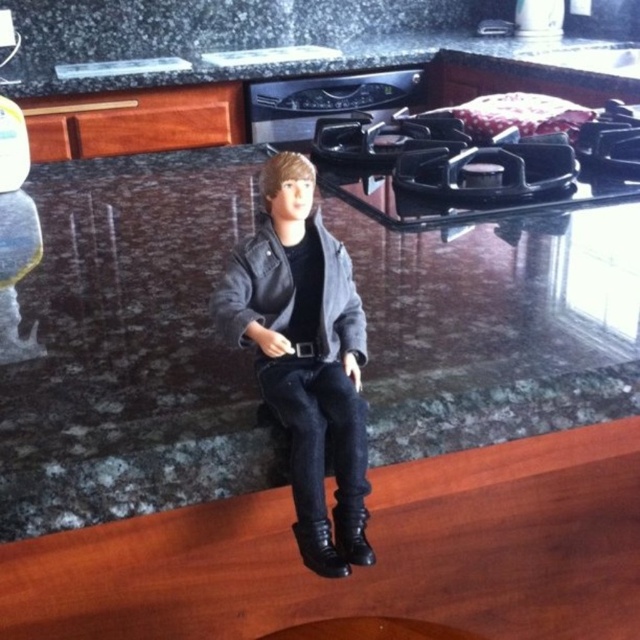
Question: Which object is closer to the camera taking this photo?

Choices:
 (A) leather jacket at center
 (B) granite countertop at upper center

Answer: (A)

Question: Observing the image, what is the correct spatial positioning of granite countertop at upper center in reference to leather jacket at center?

Choices:
 (A) above
 (B) below

Answer: (A)

Question: Is the position of granite countertop at upper center more distant than that of leather jacket at center?

Choices:
 (A) no
 (B) yes

Answer: (B)

Question: Where is granite countertop at upper center located in relation to leather jacket at center in the image?

Choices:
 (A) above
 (B) below

Answer: (A)